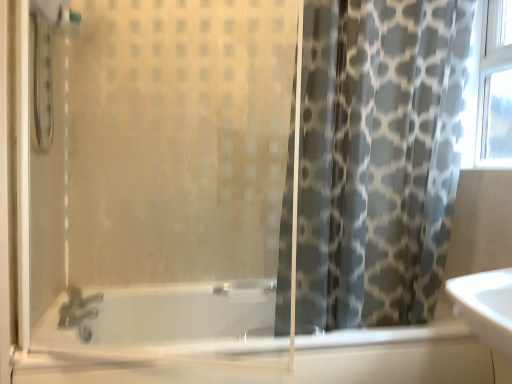
Question: Does transparent glass shower door at left have a greater width compared to translucent glass bathtub at lower center?

Choices:
 (A) yes
 (B) no

Answer: (B)

Question: Is translucent glass bathtub at lower center completely or partially inside transparent glass shower door at left?

Choices:
 (A) no
 (B) yes

Answer: (A)

Question: Is translucent glass bathtub at lower center at the back of transparent glass shower door at left?

Choices:
 (A) no
 (B) yes

Answer: (A)

Question: Does transparent glass shower door at left appear on the left side of translucent glass bathtub at lower center?

Choices:
 (A) yes
 (B) no

Answer: (A)

Question: Considering the relative positions of transparent glass shower door at left and translucent glass bathtub at lower center in the image provided, is transparent glass shower door at left to the right of translucent glass bathtub at lower center from the viewer's perspective?

Choices:
 (A) no
 (B) yes

Answer: (A)

Question: Considering the relative sizes of transparent glass shower door at left and translucent glass bathtub at lower center in the image provided, is transparent glass shower door at left shorter than translucent glass bathtub at lower center?

Choices:
 (A) no
 (B) yes

Answer: (A)

Question: Would you say gray fabric curtain at right contains transparent glass shower door at left?

Choices:
 (A) no
 (B) yes

Answer: (A)

Question: Is gray fabric curtain at right next to transparent glass shower door at left?

Choices:
 (A) yes
 (B) no

Answer: (B)

Question: Is gray fabric curtain at right oriented towards transparent glass shower door at left?

Choices:
 (A) yes
 (B) no

Answer: (B)

Question: Can you confirm if gray fabric curtain at right is thinner than transparent glass shower door at left?

Choices:
 (A) yes
 (B) no

Answer: (B)

Question: Can you confirm if gray fabric curtain at right is bigger than transparent glass shower door at left?

Choices:
 (A) no
 (B) yes

Answer: (B)

Question: Considering the relative sizes of gray fabric curtain at right and transparent glass shower door at left in the image provided, is gray fabric curtain at right wider than transparent glass shower door at left?

Choices:
 (A) yes
 (B) no

Answer: (A)

Question: Is gray fabric curtain at right thinner than translucent glass bathtub at lower center?

Choices:
 (A) yes
 (B) no

Answer: (A)